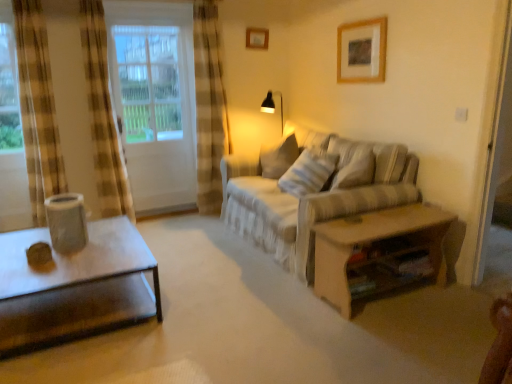
The image size is (512, 384). Identify the location of vacant space underneath white glass door at left (from a real-world perspective). (166, 217).